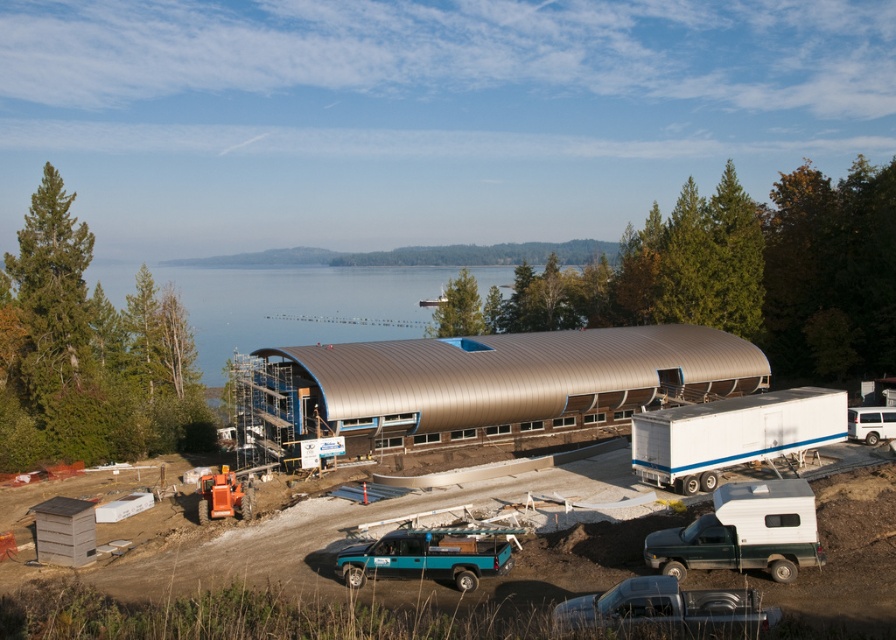
You are a construction worker standing at the point labeled as point (731, 433). You need to move to the nearest construction material storage area located at the white matte trailer truck at right. Can you directly walk there without crossing any obstacles?

The point (731, 433) is on the white matte trailer truck at right, so you are already at the construction material storage area. No need to move.

From the picture: You are a construction worker who needs to transport materials from the white matte trailer truck at right to the construction site near the metallic water at center. Which direction should you move the materials to reach the site?

You should move the materials to the left, as the metallic water at center is located to the left of the white matte trailer truck at right, meaning the construction site is in that direction.

You are a construction worker who needs to move a heavy equipment from the white matte trailer truck at right to the green matte truck at lower right. The equipment requires a minimum clearance of 16 meters between the two trucks. Can you safely move the equipment based on the distance provided?

The distance between the white matte trailer truck at right and the green matte truck at lower right is 15.78 meters, which is less than the required 16 meters clearance. Therefore, it is not safe to move the equipment.